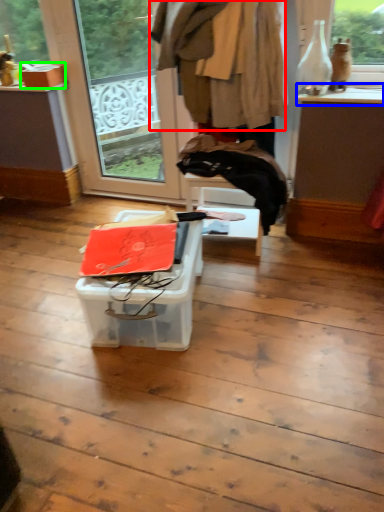
Question: Which object is the farthest from clothing (highlighted by a red box)? Choose among these: window sill (highlighted by a blue box) or cardboard box (highlighted by a green box).

Choices:
 (A) window sill
 (B) cardboard box

Answer: (B)